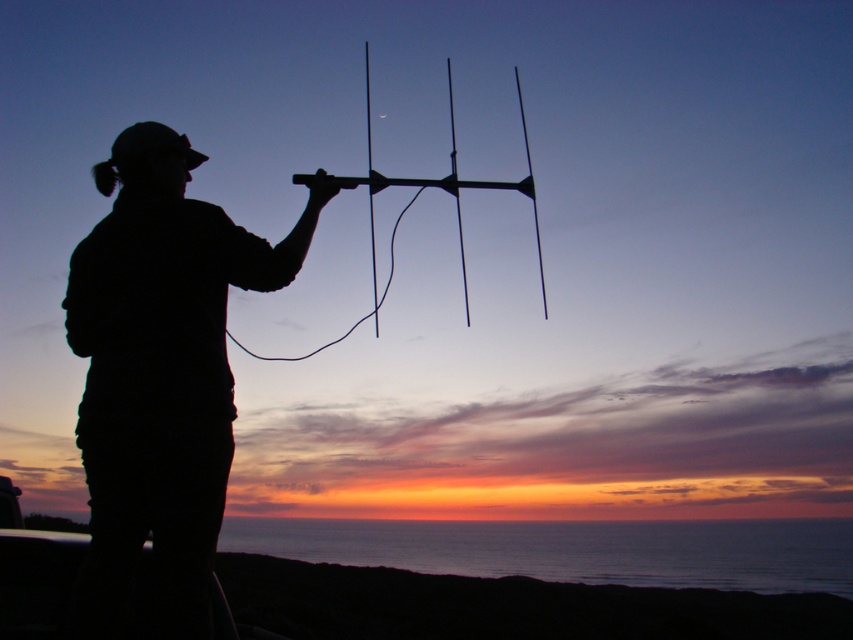
Locate an element on the screen. This screenshot has width=853, height=640. silhouette fabric at left is located at coordinates (160, 374).

Measure the distance between silhouette fabric at left and camera.

They are 2.91 meters apart.

The image size is (853, 640). In order to click on silhouette fabric at left in this screenshot , I will do `click(160, 374)`.